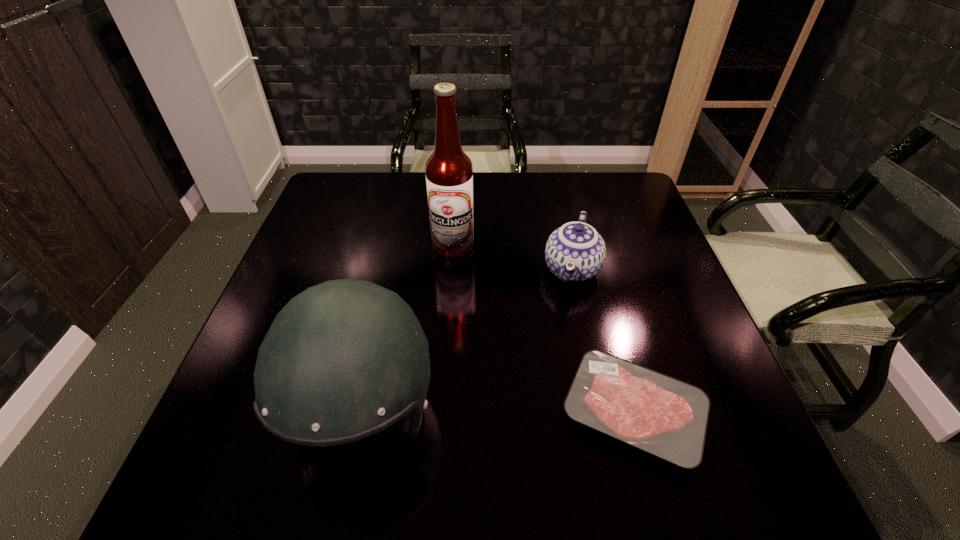
Locate an element on the screen. This screenshot has height=540, width=960. free point at the far left corner is located at coordinates tap(314, 216).

At what (x,y) coordinates should I click in order to perform the action: click on vacant space at the far right corner. Please return your answer as a coordinate pair (x, y). Looking at the image, I should click on [622, 179].

Where is `vacant space in between the steak and the third shortest object`? vacant space in between the steak and the third shortest object is located at coordinates (498, 413).

Where is `free space between the third tallest object and the shortest object`? free space between the third tallest object and the shortest object is located at coordinates 603,341.

Image resolution: width=960 pixels, height=540 pixels. Identify the location of vacant space that's between the steak and the second tallest object. (498, 413).

Locate an element on the screen. free space between the chinaware and the football helmet is located at coordinates (468, 342).

Identify the location of free space that is in between the alcohol and the second shortest object. Image resolution: width=960 pixels, height=540 pixels. (513, 258).

Where is `vacant space that is in between the steak and the third tallest object`? The height and width of the screenshot is (540, 960). vacant space that is in between the steak and the third tallest object is located at coordinates (603, 341).

Where is `free space between the shortest object and the third shortest object`? The height and width of the screenshot is (540, 960). free space between the shortest object and the third shortest object is located at coordinates (498, 413).

At what (x,y) coordinates should I click in order to perform the action: click on unoccupied position between the chinaware and the shortest object. Please return your answer as a coordinate pair (x, y). This screenshot has height=540, width=960. Looking at the image, I should click on (603, 341).